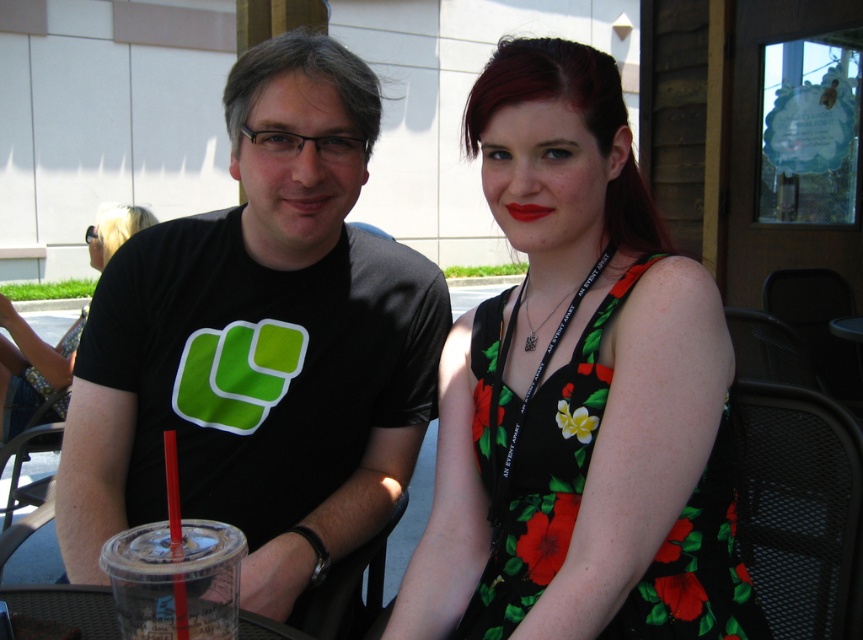
Question: Is black matte t-shirt at center further to camera compared to floral print fabric dress at center?

Choices:
 (A) yes
 (B) no

Answer: (A)

Question: Is black matte t-shirt at center smaller than clear plastic cup at lower left?

Choices:
 (A) yes
 (B) no

Answer: (B)

Question: Among these points, which one is farthest from the camera?

Choices:
 (A) (0, 307)
 (B) (591, 394)

Answer: (A)

Question: Can you confirm if black matte t-shirt at center is wider than clear plastic cup at lower left?

Choices:
 (A) no
 (B) yes

Answer: (B)

Question: Which of the following is the farthest from the observer?

Choices:
 (A) (565, 388)
 (B) (307, 637)

Answer: (A)

Question: Which object is farther from the camera taking this photo?

Choices:
 (A) clear plastic cup at lower left
 (B) black floral dress at center
 (C) black matte t-shirt at center

Answer: (B)